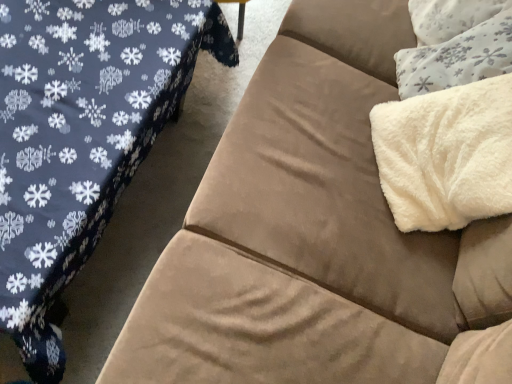
Question: From a real-world perspective, is white fluffy blanket at upper right over white fluffy throw pillow at upper right?

Choices:
 (A) no
 (B) yes

Answer: (B)

Question: From a real-world perspective, is white fluffy blanket at upper right physically below white fluffy throw pillow at upper right?

Choices:
 (A) yes
 (B) no

Answer: (B)

Question: Is white fluffy blanket at upper right outside of white fluffy throw pillow at upper right?

Choices:
 (A) yes
 (B) no

Answer: (A)

Question: Does white fluffy blanket at upper right have a greater width compared to white fluffy throw pillow at upper right?

Choices:
 (A) yes
 (B) no

Answer: (B)

Question: Is white fluffy blanket at upper right positioned behind white fluffy throw pillow at upper right?

Choices:
 (A) yes
 (B) no

Answer: (B)

Question: Based on their sizes in the image, would you say white fluffy blanket at upper right is bigger or smaller than suede couch at right?

Choices:
 (A) big
 (B) small

Answer: (B)

Question: Is point (461, 172) positioned closer to the camera than point (53, 114)?

Choices:
 (A) farther
 (B) closer

Answer: (A)

Question: Relative to suede couch at right, is white fluffy blanket at upper right in front or behind?

Choices:
 (A) front
 (B) behind

Answer: (B)

Question: Is white fluffy blanket at upper right wider or thinner than suede couch at right?

Choices:
 (A) thin
 (B) wide

Answer: (A)

Question: Is white fluffy blanket at upper right to the left or to the right of white fluffy throw pillow at upper right in the image?

Choices:
 (A) right
 (B) left

Answer: (B)

Question: Is white fluffy blanket at upper right bigger or smaller than white fluffy throw pillow at upper right?

Choices:
 (A) big
 (B) small

Answer: (A)

Question: From a real-world perspective, relative to white fluffy throw pillow at upper right, is white fluffy blanket at upper right vertically above or below?

Choices:
 (A) below
 (B) above

Answer: (B)

Question: Would you say white fluffy blanket at upper right is inside or outside white fluffy throw pillow at upper right?

Choices:
 (A) outside
 (B) inside

Answer: (A)

Question: From a real-world perspective, is white fluffy throw pillow at upper right above or below white fluffy blanket at upper right?

Choices:
 (A) below
 (B) above

Answer: (A)

Question: From the image's perspective, is white fluffy throw pillow at upper right positioned above or below white fluffy blanket at upper right?

Choices:
 (A) above
 (B) below

Answer: (A)